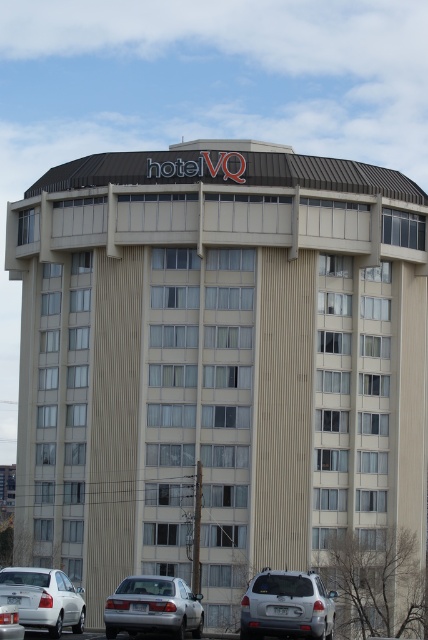
Is point (306, 616) in front of point (122, 595)?

Yes, it is.

What do you see at coordinates (287, 605) in the screenshot? I see `silver metallic suv at lower center` at bounding box center [287, 605].

Does point (273, 577) come farther from viewer compared to point (162, 625)?

Yes, point (273, 577) is behind point (162, 625).

You are a GUI agent. You are given a task and a screenshot of the screen. Output one action in this format:
    pyautogui.click(x=<x>, y=<y>)
    Task: Click on the silver metallic suv at lower center
    Image resolution: width=428 pixels, height=640 pixels.
    Given the screenshot: What is the action you would take?
    pyautogui.click(x=287, y=605)

Which is below, silver metallic suv at lower center or white matte sedan at lower left?

Positioned lower is silver metallic suv at lower center.

Does silver metallic suv at lower center appear over white matte sedan at lower left?

Actually, silver metallic suv at lower center is below white matte sedan at lower left.

You are a GUI agent. You are given a task and a screenshot of the screen. Output one action in this format:
    pyautogui.click(x=<x>, y=<y>)
    Task: Click on the silver metallic suv at lower center
    The image size is (428, 640).
    Given the screenshot: What is the action you would take?
    pyautogui.click(x=287, y=605)

Who is lower down, silver metallic sedan at lower left or white matte sedan at lower left?

silver metallic sedan at lower left is lower down.

Between silver metallic sedan at lower left and white matte sedan at lower left, which one appears on the left side from the viewer's perspective?

white matte sedan at lower left

Describe the element at coordinates (154, 608) in the screenshot. I see `silver metallic sedan at lower left` at that location.

You are a GUI agent. You are given a task and a screenshot of the screen. Output one action in this format:
    pyautogui.click(x=<x>, y=<y>)
    Task: Click on the silver metallic sedan at lower left
    The image size is (428, 640).
    Given the screenshot: What is the action you would take?
    pyautogui.click(x=154, y=608)